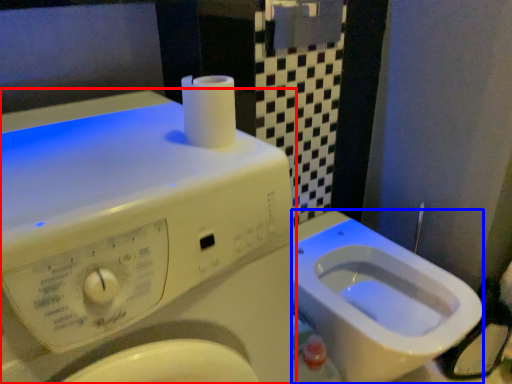
Question: Which object appears closest to the camera in this image, washing machine (highlighted by a red box) or bidet (highlighted by a blue box)?

Choices:
 (A) washing machine
 (B) bidet

Answer: (A)